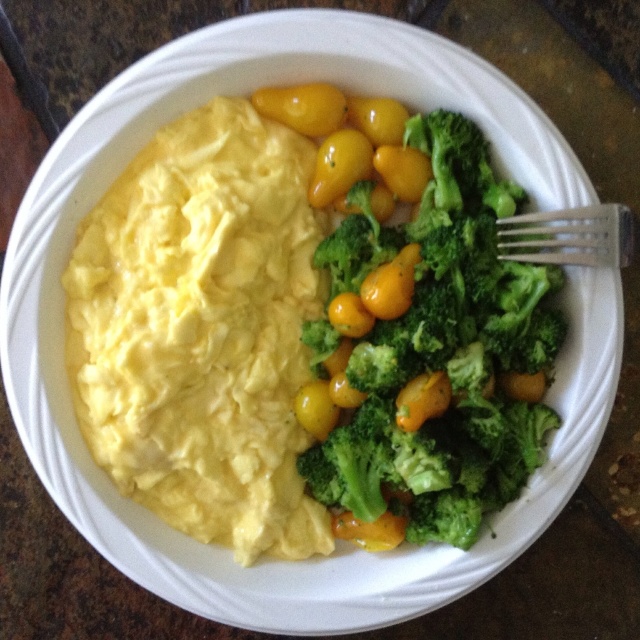
You are a diner who wants to eat the yellow creamy scrambled eggs at left but your hand is currently holding the silver metallic fork at upper right. Can you reach the eggs without moving the fork?

The silver metallic fork at upper right is behind the yellow creamy scrambled eggs at left, so you can reach the eggs without moving the fork because the fork is not blocking the path to the eggs.

You are standing 4 feet away from the plate of food. If you want to grab the yellow creamy scrambled eggs at left, will you be able to reach them without moving closer?

The yellow creamy scrambled eggs at left are 3.71 feet away from the viewer, which is within the 4 feet distance you mentioned. Therefore, you can reach them without moving closer.

You are a chef arranging ingredients on a plate. You have two points marked on the plate where you need to place garnishes. The first point is at coordinate point[131,298] and the second is at point[541,240]. According to the image, which point is closer to the viewer?

Point[541,240] is closer to the viewer because it is in front of point[131,298].